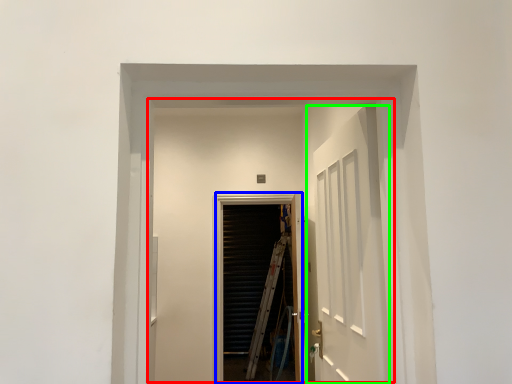
Question: Which is nearer to the elevator (highlighted by a red box)? screen door (highlighted by a blue box) or door (highlighted by a green box).

Choices:
 (A) screen door
 (B) door

Answer: (A)